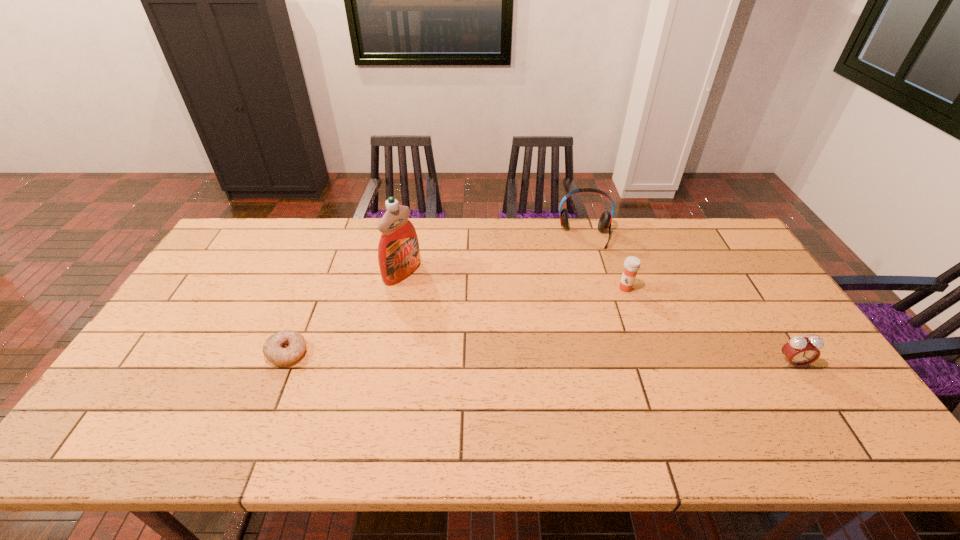
Where is `free space located 0.350m on the label side of the medicine`? free space located 0.350m on the label side of the medicine is located at coordinates (571, 368).

Where is `vacant space located 0.050m on the label side of the medicine`? The height and width of the screenshot is (540, 960). vacant space located 0.050m on the label side of the medicine is located at coordinates (616, 302).

The image size is (960, 540). What are the coordinates of `vacant area situated on the label side of the medicine` in the screenshot? It's located at (613, 306).

What are the coordinates of `free spot located on the front surface of the second object from left to right` in the screenshot? It's located at (501, 327).

The width and height of the screenshot is (960, 540). Find the location of `vacant region located on the front surface of the second object from left to right`. vacant region located on the front surface of the second object from left to right is located at coordinates (437, 293).

You are a GUI agent. You are given a task and a screenshot of the screen. Output one action in this format:
    pyautogui.click(x=<x>, y=<y>)
    Task: Click on the vacant space located on the front surface of the second object from left to right
    
    Given the screenshot: What is the action you would take?
    pyautogui.click(x=521, y=339)

The height and width of the screenshot is (540, 960). Find the location of `vacant space located 0.210m with the microphone attached to the side of the fourth shortest object`. vacant space located 0.210m with the microphone attached to the side of the fourth shortest object is located at coordinates (589, 291).

What are the coordinates of `vacant area located 0.370m with the microphone attached to the side of the fourth shortest object` in the screenshot? It's located at (593, 330).

What are the coordinates of `free spot located 0.400m with the microphone attached to the side of the fourth shortest object` in the screenshot? It's located at (594, 338).

What are the coordinates of `detergent situated at the far edge` in the screenshot? It's located at (398, 251).